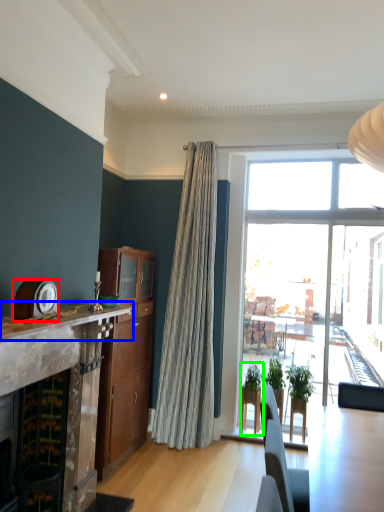
Question: Which object is positioned closest to clock (highlighted by a red box)? Select from mantle (highlighted by a blue box) and houseplant (highlighted by a green box).

Choices:
 (A) mantle
 (B) houseplant

Answer: (A)